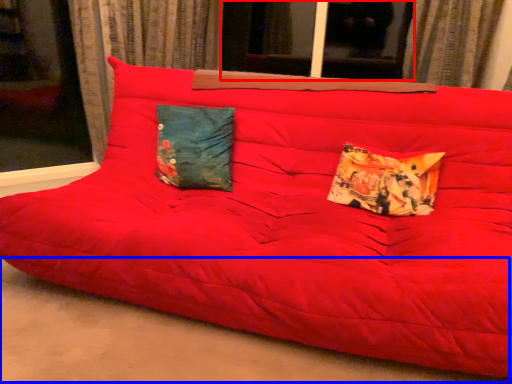
Question: Which object is closer to the camera taking this photo, window (highlighted by a red box) or concrete (highlighted by a blue box)?

Choices:
 (A) window
 (B) concrete

Answer: (B)